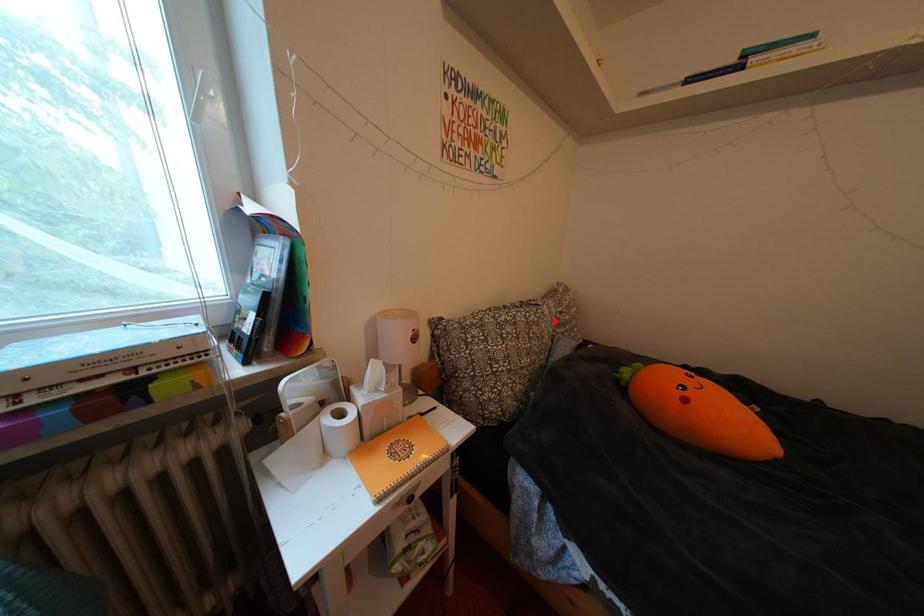
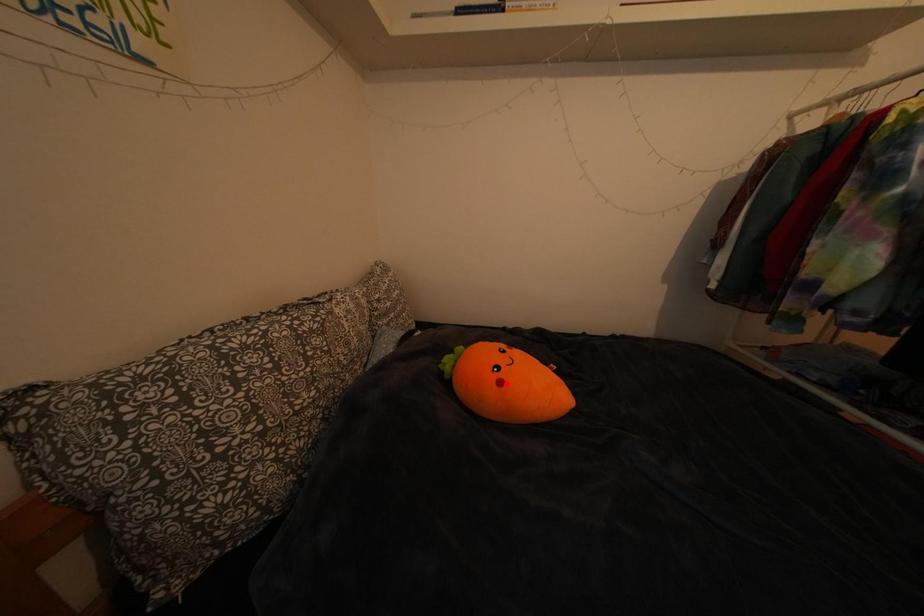
I am providing you with two images of the same scene from different viewpoints. A red point is marked on the first image and another point is marked on the second image. Do the highlighted points in image1 and image2 indicate the same real-world spot?

No